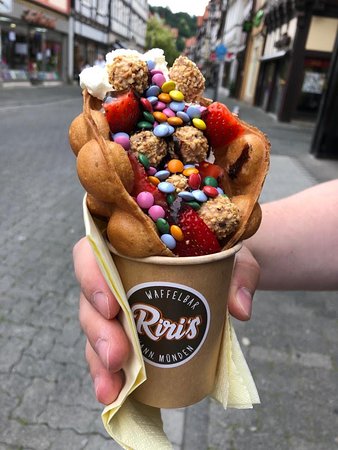
In order to click on cup in this screenshot , I will do `click(162, 348)`.